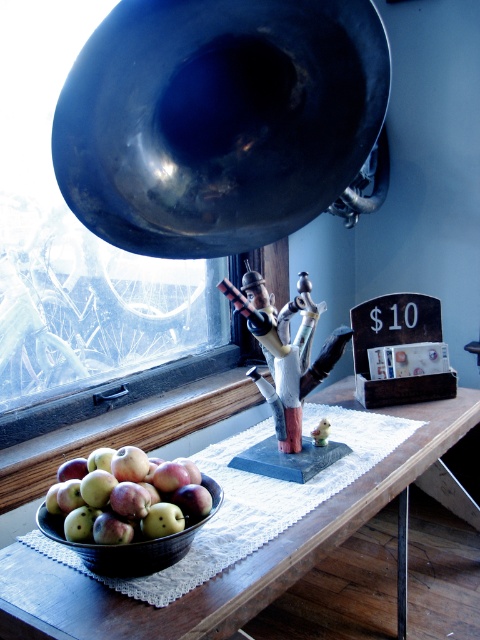
You are a guest sitting at the wooden table at lower left and want to grab the green matte apples at lower left. Can you easily reach them without moving your seat?

The wooden table at lower left is closer to the viewer than the green matte apples at lower left, so the apples are farther away from you. You might need to move your seat closer or extend your reach to grab them.

You are arranging items on a table and need to place the shiny black trumpet at upper center and the green matte apples at lower left. Based on their current positions, which item is positioned to the right side of the table?

The shiny black trumpet at upper center is positioned to the right of the green matte apples at lower left, so the shiny black trumpet at upper center is on the right side of the table.

You are setting up a display on a table and have a shiny black trumpet at upper center and green matte apples at lower left. Which object takes up more space on the table?

The shiny black trumpet at upper center is bigger than the green matte apples at lower left, so it takes up more space on the table.